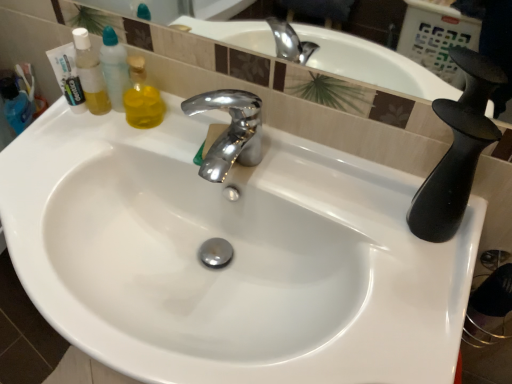
Find the location of a particular element. vacant area that is in front of translucent plastic mouthwash at left is located at coordinates (72, 151).